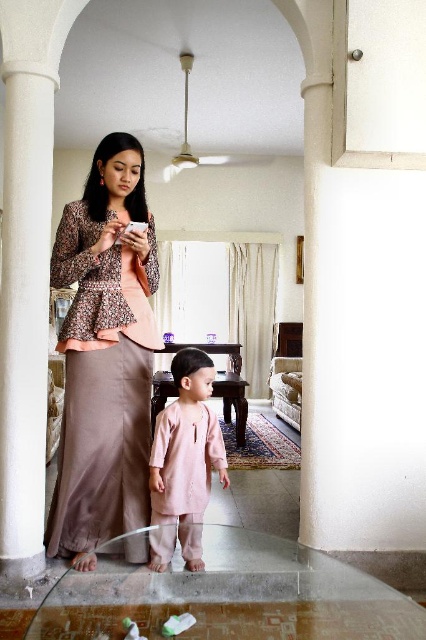
You are a fashion designer observing the scene through the doorway. You notice two garments at the center of the image. Which garment is closer to you, the matte brown peplum top at center or the pale pink fabric at center?

The matte brown peplum top at center is closer to you because it is in front of the pale pink fabric at center.

From the picture: You are an interior designer assessing the color coordination in the image. The scene shows a matte brown peplum top at center and a pale pink fabric at center. Which of these two items is positioned higher in the visual hierarchy?

The matte brown peplum top at center is above the pale pink fabric at center, making it the higher positioned item in the visual hierarchy.